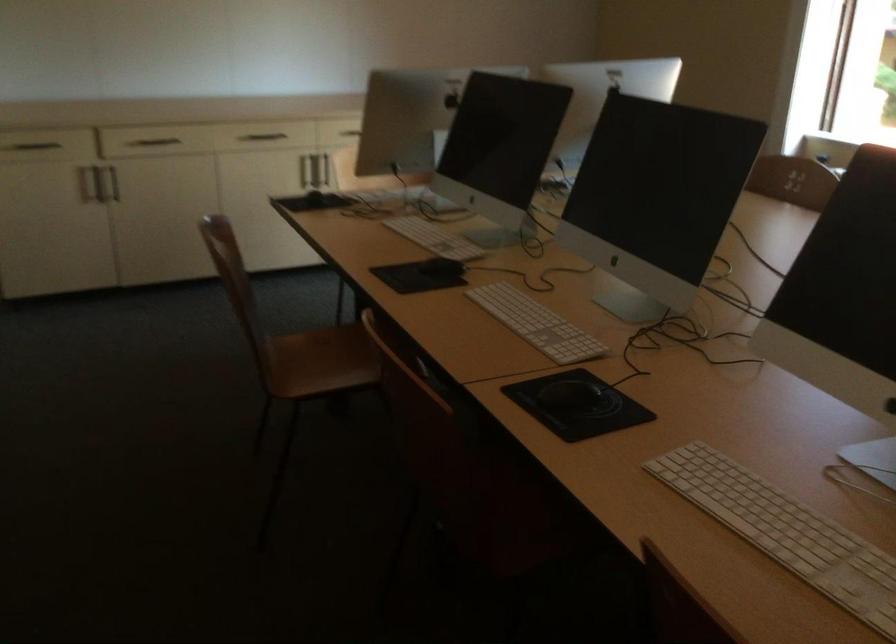
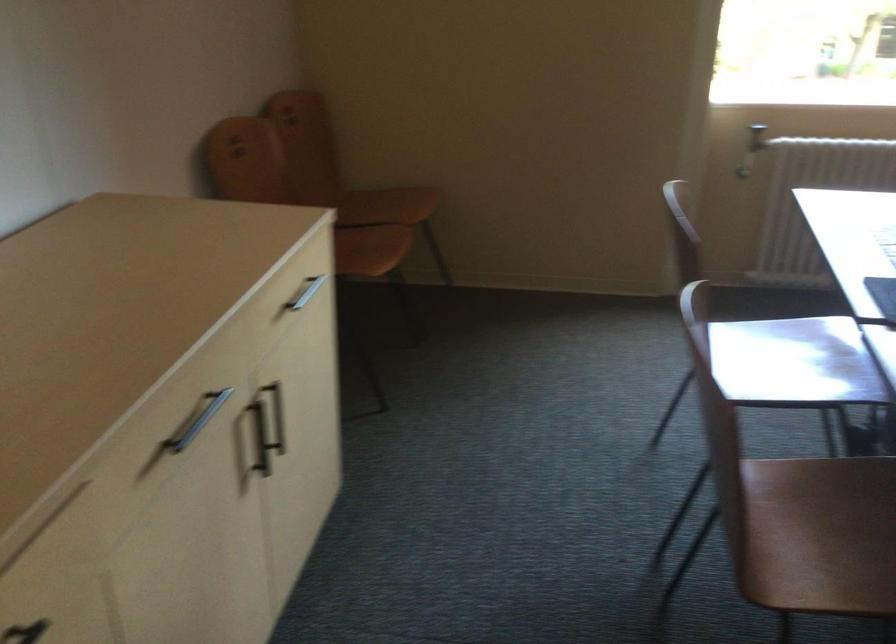
Locate, in the second image, the point that corresponds to point 313,172 in the first image.

(260, 438)